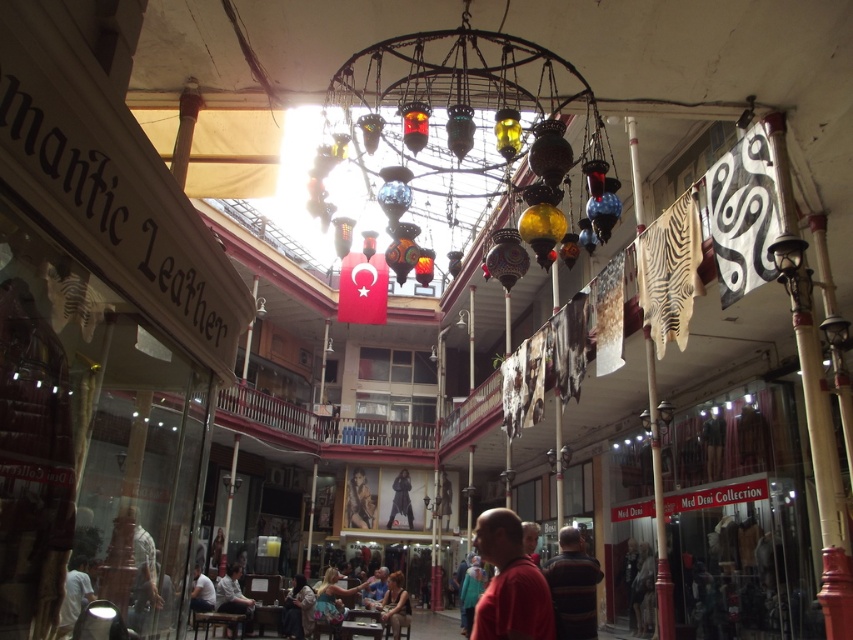
You are organizing a charity clothing drive and need to pack items into boxes. You have a small box and a large box available. Given the sizes of the striped sweater at center and the smooth brown leather jacket at center, which item should go into the small box?

The striped sweater at center should go into the small box because it occupies less space than the smooth brown leather jacket at center.

You are shopping at the bazaar and see two leather jackets hanging on a rack at the center of the store. The jackets are described as dark blue leather jacket at center and smooth brown leather jacket at center. Which one is positioned to the left when viewed from the front?

The dark blue leather jacket at center is positioned to the left of the smooth brown leather jacket at center when viewed from the front.